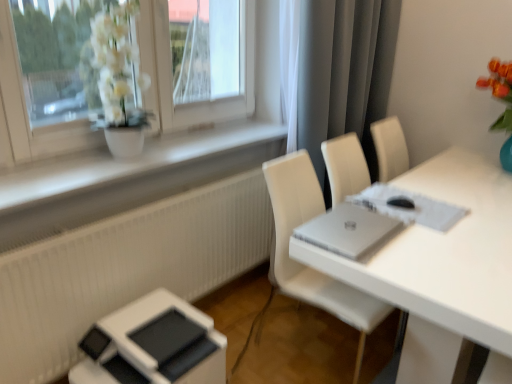
Where is `free location to the right of silver metallic laptop at center`? This screenshot has width=512, height=384. free location to the right of silver metallic laptop at center is located at coordinates (432, 245).